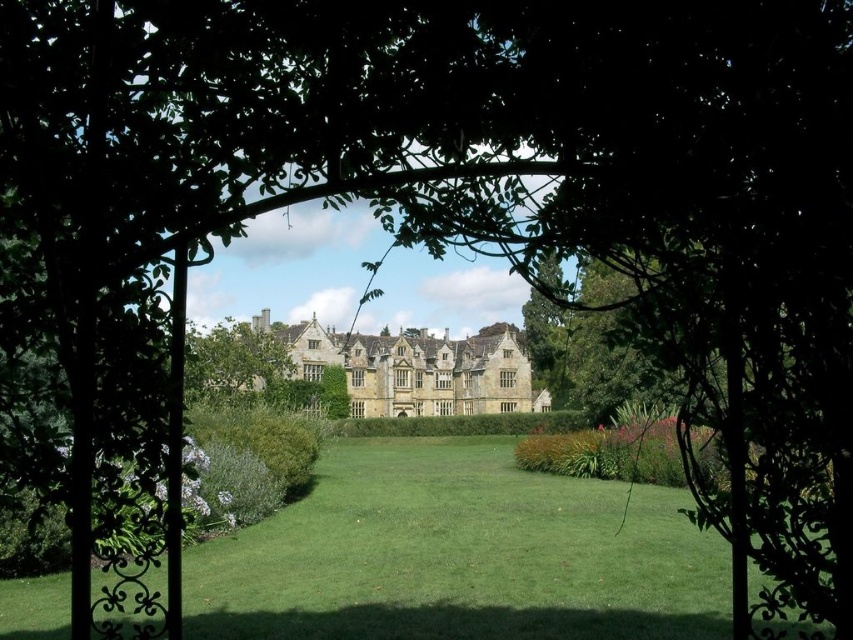
You are standing at the archway and want to take a photo of the grand stone building. The camera you are using has a maximum focus range of 85 meters. Will the point at point (225, 637) be in focus?

The distance of point (225, 637) from the camera is 90.31 meters, which exceeds the camera maximum focus range of 85 meters. Therefore, the point will not be in focus.

You are standing in a garden and see the green grass at center and the green leafy tree at center. Which object takes up more space in the image?

The green grass at center is larger in size than the green leafy tree at center, so it takes up more space in the image.

You are standing in a garden and see the green grass at center and the green leafy tree at center. Which object is positioned to the right side?

The green grass at center is to the right of the green leafy tree at center.